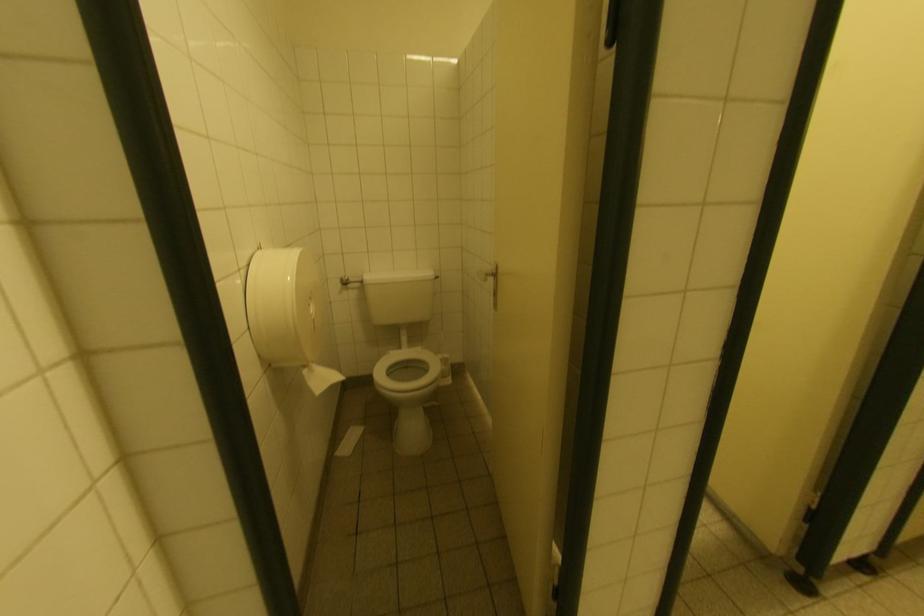
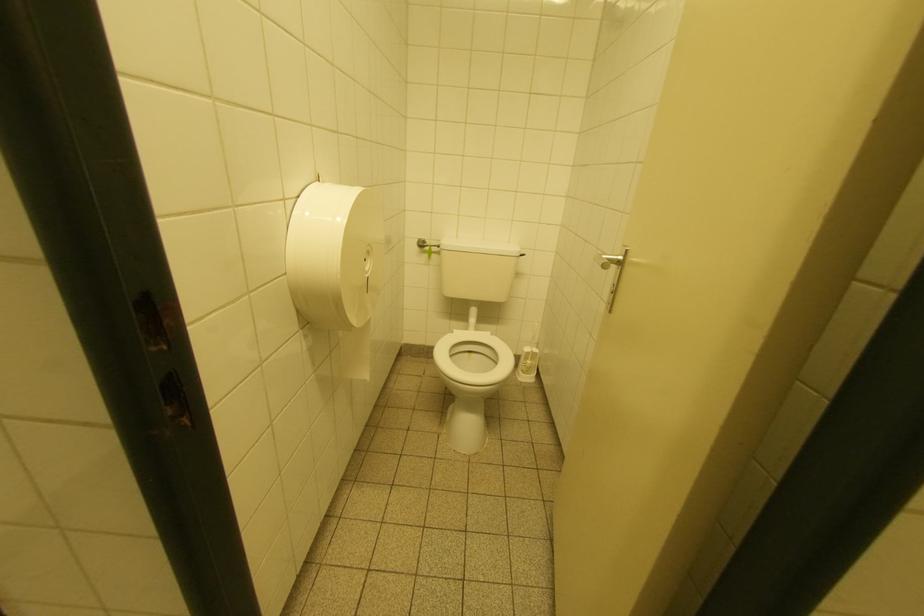
In a continuous first-person perspective shot, in which direction is the camera moving?

The cameraman walked toward right, forward.